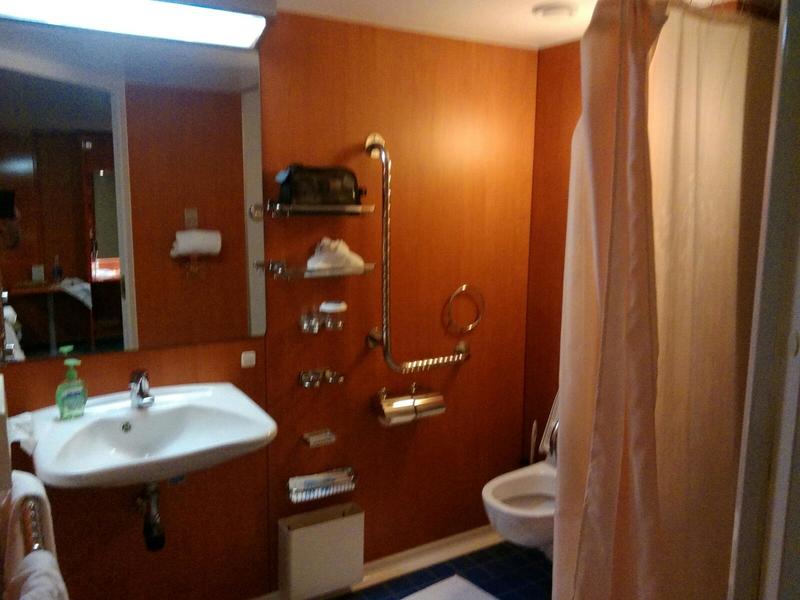
Identify the location of fluorescent tube overhead light. This screenshot has height=600, width=800. (190, 31).